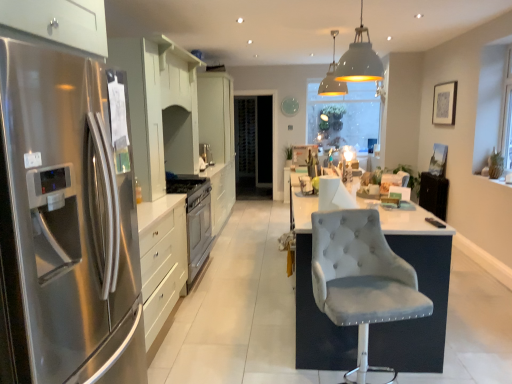
Question: Is the position of matte white pendant lamp at upper center, the 2th light fixture positioned from the front, more distant than that of velvet grey chair at center?

Choices:
 (A) yes
 (B) no

Answer: (A)

Question: From a real-world perspective, does matte white pendant lamp at upper center, the 1th light fixture when ordered from back to front, sit lower than velvet grey chair at center?

Choices:
 (A) yes
 (B) no

Answer: (B)

Question: Can you confirm if matte white pendant lamp at upper center, the 1th light fixture when ordered from back to front, is positioned to the left of velvet grey chair at center?

Choices:
 (A) no
 (B) yes

Answer: (A)

Question: Considering the relative sizes of matte white pendant lamp at upper center, the 1th light fixture when ordered from back to front, and velvet grey chair at center in the image provided, is matte white pendant lamp at upper center, the 1th light fixture when ordered from back to front, shorter than velvet grey chair at center?

Choices:
 (A) no
 (B) yes

Answer: (B)

Question: Would you say matte white pendant lamp at upper center, the 2th light fixture positioned from the front, is outside velvet grey chair at center?

Choices:
 (A) no
 (B) yes

Answer: (B)

Question: From a real-world perspective, is matte white pendant lamp at upper center, the 2th light fixture positioned from the front, physically above velvet grey chair at center?

Choices:
 (A) yes
 (B) no

Answer: (A)

Question: From the image's perspective, is white matte pendant lamp at upper center, the first light fixture positioned from the front, below transparent glass door at center?

Choices:
 (A) no
 (B) yes

Answer: (A)

Question: From the image's perspective, is white matte pendant lamp at upper center, marked as the 2th light fixture in a back-to-front arrangement, over transparent glass door at center?

Choices:
 (A) yes
 (B) no

Answer: (A)

Question: Can you confirm if white matte pendant lamp at upper center, the first light fixture positioned from the front, is positioned to the left of transparent glass door at center?

Choices:
 (A) no
 (B) yes

Answer: (A)

Question: Is white matte pendant lamp at upper center, the first light fixture positioned from the front, next to transparent glass door at center?

Choices:
 (A) no
 (B) yes

Answer: (A)

Question: Does white matte pendant lamp at upper center, marked as the 2th light fixture in a back-to-front arrangement, have a lesser height compared to transparent glass door at center?

Choices:
 (A) no
 (B) yes

Answer: (B)

Question: Considering the relative positions of white matte pendant lamp at upper center, the first light fixture positioned from the front, and transparent glass door at center in the image provided, is white matte pendant lamp at upper center, the first light fixture positioned from the front, in front of transparent glass door at center?

Choices:
 (A) yes
 (B) no

Answer: (A)

Question: Does white glossy cabinets at center have a smaller size compared to stainless steel refrigerator at left?

Choices:
 (A) yes
 (B) no

Answer: (B)